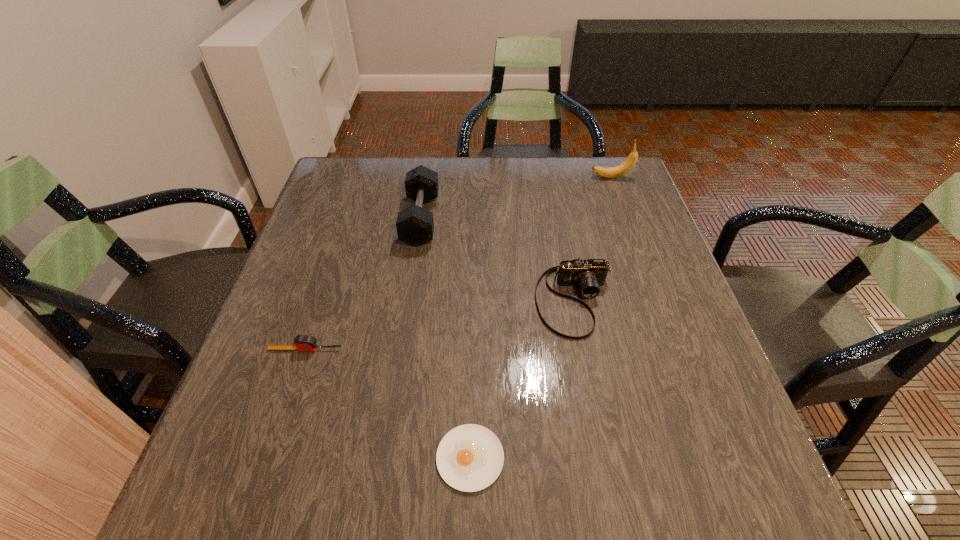
You are a GUI agent. You are given a task and a screenshot of the screen. Output one action in this format:
    pyautogui.click(x=<x>, y=<y>)
    Task: Click on the vacant space situated 0.370m at the start of the peel on the banana
    This screenshot has width=960, height=540.
    Given the screenshot: What is the action you would take?
    pyautogui.click(x=468, y=177)

Find the location of `free region located 0.060m at the start of the peel on the banana`. free region located 0.060m at the start of the peel on the banana is located at coordinates (570, 177).

This screenshot has height=540, width=960. What are the coordinates of `vacant space located at the start of the peel on the banana` in the screenshot? It's located at (551, 177).

Find the location of a particular element. The image size is (960, 540). free point located 0.060m on the front of the dumbbell is located at coordinates (414, 266).

The height and width of the screenshot is (540, 960). In order to click on free location located 0.150m on the front-facing side of the third tallest object in this screenshot , I will do [x=595, y=407].

Locate an element on the screen. The height and width of the screenshot is (540, 960). free location located on the front of the second shortest object is located at coordinates (292, 389).

Where is `vacant space located on the left of the shortest object`? The width and height of the screenshot is (960, 540). vacant space located on the left of the shortest object is located at coordinates (281, 458).

This screenshot has height=540, width=960. Find the location of `banana that is at the far edge`. banana that is at the far edge is located at coordinates (607, 172).

The width and height of the screenshot is (960, 540). What are the coordinates of `dumbbell that is at the far edge` in the screenshot? It's located at [415, 226].

This screenshot has width=960, height=540. I want to click on object that is positioned at the near edge, so click(x=470, y=457).